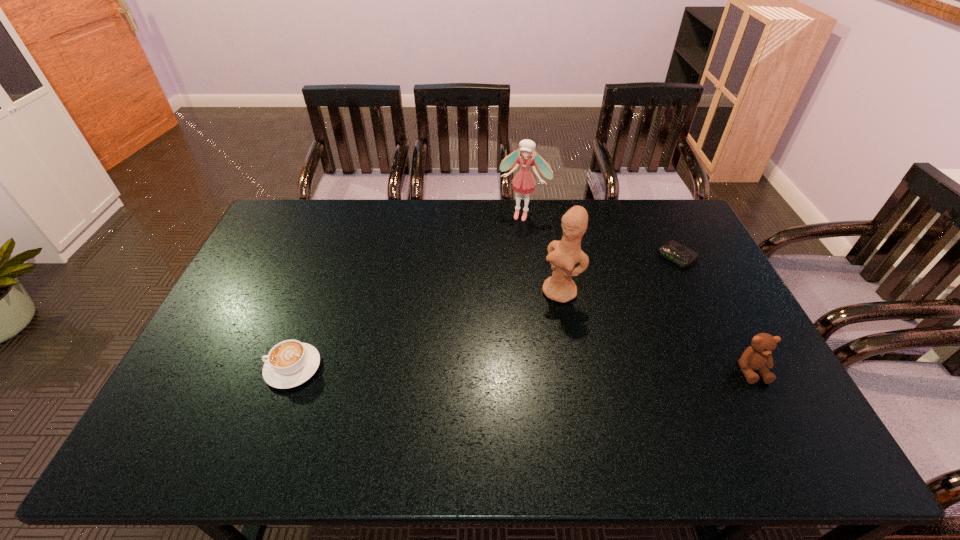
Find the location of a particular element. Image resolution: width=960 pixels, height=540 pixels. vacant space at the far left corner of the desktop is located at coordinates (263, 235).

The height and width of the screenshot is (540, 960). I want to click on vacant space at the far right corner, so click(689, 225).

Locate an element on the screen. This screenshot has height=540, width=960. empty location between the farthest object and the figurine is located at coordinates (541, 254).

Identify the location of unoccupied area between the third shortest object and the cappuccino. (522, 369).

Find the location of a particular element. The width and height of the screenshot is (960, 540). free space between the second farthest object and the third shortest object is located at coordinates (714, 314).

Image resolution: width=960 pixels, height=540 pixels. In order to click on empty space that is in between the figurine and the alarm clock in this screenshot , I will do `click(618, 275)`.

Image resolution: width=960 pixels, height=540 pixels. I want to click on free space that is in between the third tallest object and the cappuccino, so click(x=522, y=369).

The height and width of the screenshot is (540, 960). I want to click on free point between the figurine and the third shortest object, so click(656, 332).

What are the coordinates of `empty space between the cappuccino and the third tallest object` in the screenshot? It's located at (522, 369).

Find the location of a particular element. This screenshot has width=960, height=540. vacant space in between the teddy bear and the third nearest object is located at coordinates (656, 332).